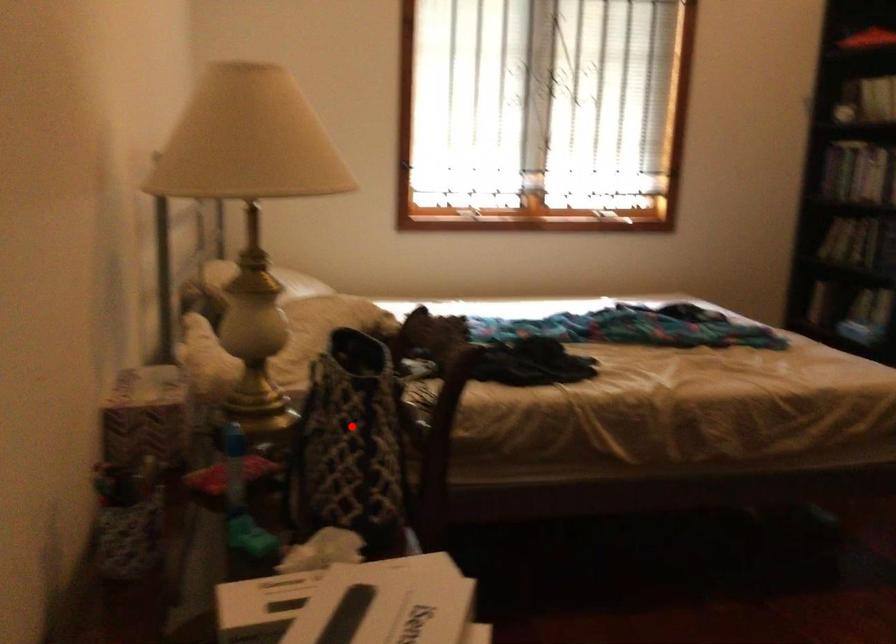
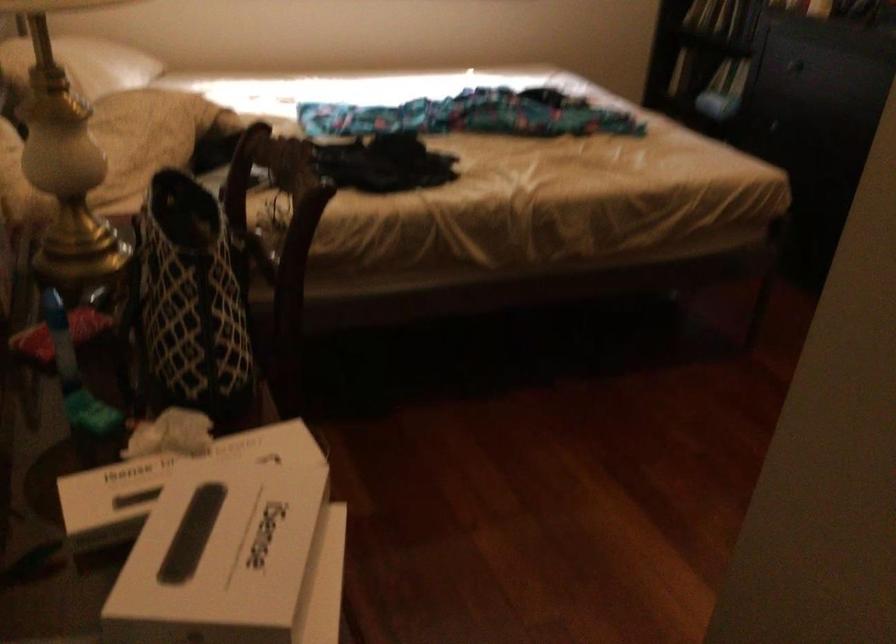
Question: I am providing you with two images of the same scene from different viewpoints. In image1, a red point is highlighted. Considering the same 3D point in image2, which of the following is correct?

Choices:
 (A) It is closer
 (B) It is farther

Answer: (A)